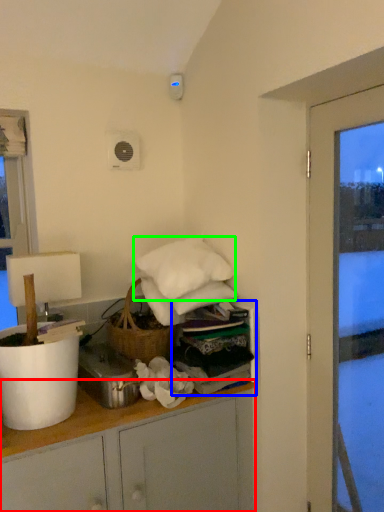
Question: Based on their relative distances, which object is nearer to cabinetry (highlighted by a red box)? Choose from shelf (highlighted by a blue box) and pillow (highlighted by a green box).

Choices:
 (A) shelf
 (B) pillow

Answer: (A)